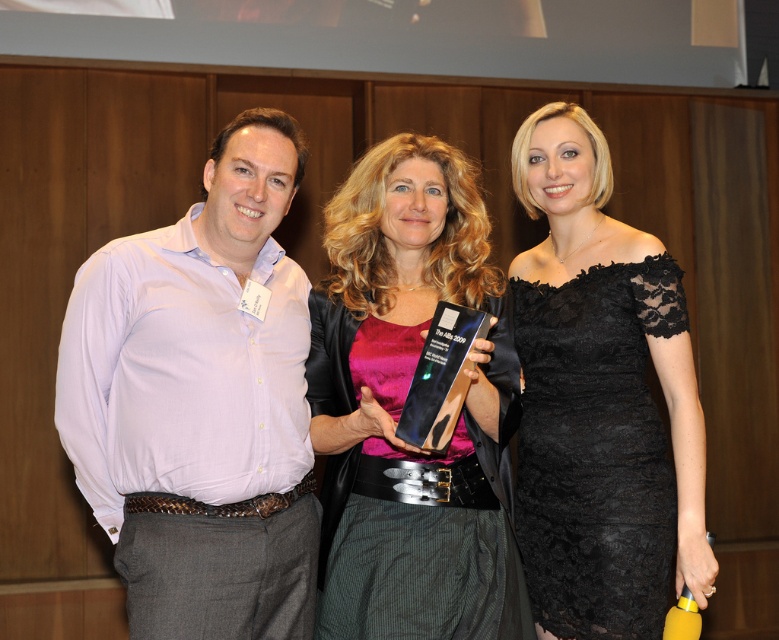
Question: Considering the real-world distances, which object is farthest from the linen shirt at left?

Choices:
 (A) pink velvet dress at center
 (B) black lace dress at center

Answer: (B)

Question: Does linen shirt at left have a larger size compared to pink velvet dress at center?

Choices:
 (A) yes
 (B) no

Answer: (B)

Question: Which of the following is the closest to the observer?

Choices:
 (A) pink velvet dress at center
 (B) linen shirt at left
 (C) black lace dress at center

Answer: (B)

Question: Can you confirm if pink velvet dress at center is bigger than black lace dress at center?

Choices:
 (A) no
 (B) yes

Answer: (A)

Question: Among these objects, which one is nearest to the camera?

Choices:
 (A) linen shirt at left
 (B) black lace dress at center
 (C) pink velvet dress at center

Answer: (A)

Question: Considering the relative positions of pink velvet dress at center and black lace dress at center in the image provided, where is pink velvet dress at center located with respect to black lace dress at center?

Choices:
 (A) right
 (B) left

Answer: (B)